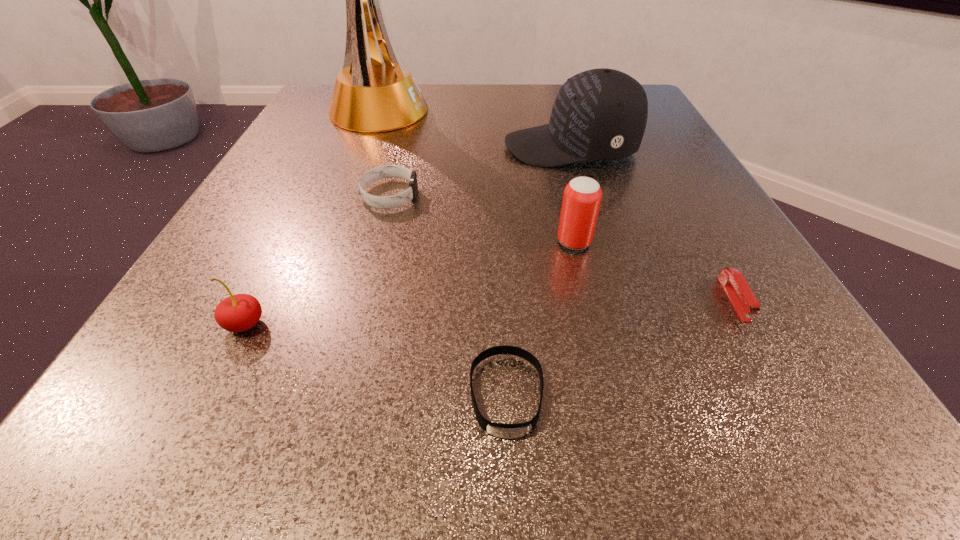
The height and width of the screenshot is (540, 960). In the image, there is a desktop. Find the location of `free space at the right edge`. free space at the right edge is located at coordinates (784, 376).

Locate an element on the screen. vacant area at the near left corner of the desktop is located at coordinates (83, 454).

What are the coordinates of `free space between the sixth shortest object and the left wristband` in the screenshot? It's located at pyautogui.click(x=480, y=171).

This screenshot has height=540, width=960. I want to click on empty space that is in between the second shortest object and the beer can, so click(x=654, y=271).

This screenshot has height=540, width=960. Identify the location of free space between the right wristband and the tallest object. (441, 253).

Find the location of a particular element. vacant region between the second tallest object and the taller wristband is located at coordinates coord(480,171).

Identify the location of empty location between the fourth farthest object and the tallest object. The image size is (960, 540). (475, 177).

Image resolution: width=960 pixels, height=540 pixels. What are the coordinates of `unoccupied area between the nearer wristband and the trophy` in the screenshot? It's located at (441, 253).

What are the coordinates of `empty space that is in between the tallest object and the baseball cap` in the screenshot? It's located at (473, 130).

You are a GUI agent. You are given a task and a screenshot of the screen. Output one action in this format:
    pyautogui.click(x=<x>, y=<y>)
    Task: Click on the unoccupied area between the nearest object and the stapler
    The width and height of the screenshot is (960, 540).
    Given the screenshot: What is the action you would take?
    pyautogui.click(x=620, y=347)